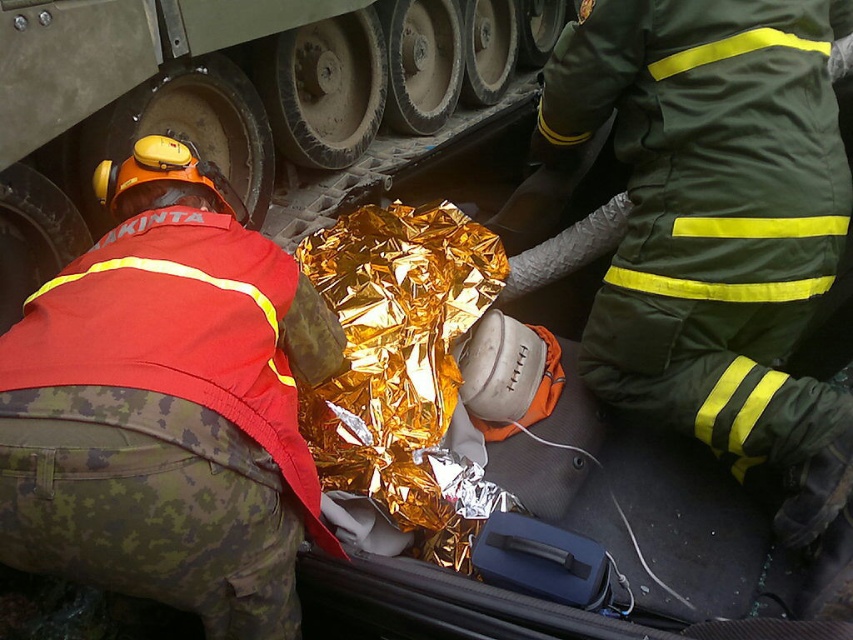
You are a medic assessing the scene. You see the camouflage pants at lower left and the green matte uniform at center. Which responder is shorter in height?

The camouflage pants at lower left is not as tall as the green matte uniform at center, so the responder with camouflage pants at lower left is shorter in height.

You are a medic in a rescue vehicle and need to quickly access the green matte uniform at center and the metallic gray tank track at center. Which object is closer to your left side when facing the front of the vehicle?

The metallic gray tank track at center is closer to your left side because the green matte uniform at center is positioned to its right.